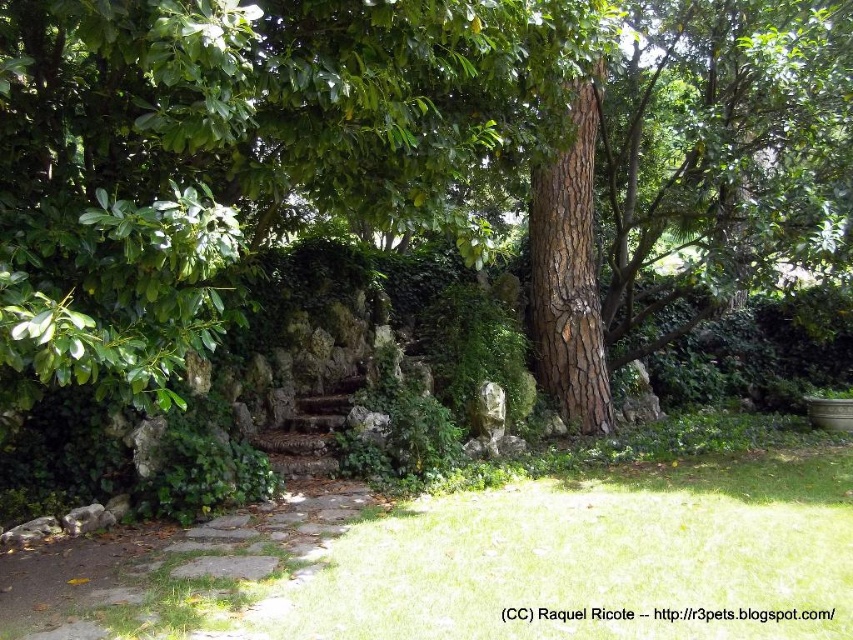
You are a gardener planning to plant a new flower bed between the brown rough tree at center and the brown stone path at lower center. Which object has a smaller width to consider for spacing?

The brown rough tree at center is thinner than the brown stone path at lower center, so the tree has a smaller width and should be considered for spacing.

You are standing at the starting point of the stone pathway in the garden. You notice two points marked in the image. The first point is at coordinate point(564, 410) and the second point is at coordinate point(0, 579). If you want to reach the point that is further away from you along the pathway, which coordinate should you head towards?

You should head towards point(564, 410) because it is behind point(0, 579), meaning it is farther along the pathway from your current position.

You are a gardener planning to plant a new flower bed between the brown rough tree at center and the brown stone path at lower center. Based on their positions, where should you place the flowers to ensure they receive adequate sunlight?

The brown rough tree at center is above the brown stone path at lower center, so placing the flowers between them would mean the tree might block sunlight. To ensure adequate sunlight, the flowers should be placed closer to the brown stone path at lower center where there is more open space and less shade from the tree.